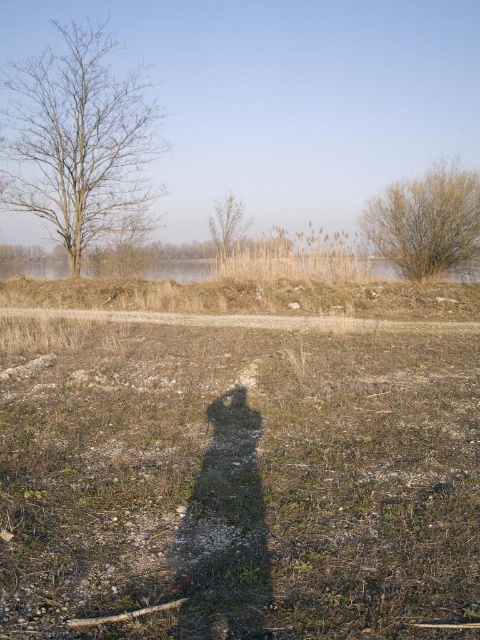
This screenshot has width=480, height=640. What do you see at coordinates (80, 144) in the screenshot?
I see `bare wood tree at upper left` at bounding box center [80, 144].

Image resolution: width=480 pixels, height=640 pixels. I want to click on bare wood tree at upper left, so click(x=80, y=144).

This screenshot has width=480, height=640. I want to click on bare wood tree at upper left, so click(x=80, y=144).

Does brown gravelly dirt field at center have a larger size compared to bare wood tree at center?

Correct, brown gravelly dirt field at center is larger in size than bare wood tree at center.

This screenshot has height=640, width=480. What are the coordinates of `brown gravelly dirt field at center` in the screenshot? It's located at (239, 465).

Image resolution: width=480 pixels, height=640 pixels. Identify the location of brown gravelly dirt field at center. pyautogui.click(x=239, y=465).

Locate an element on the screen. Image resolution: width=480 pixels, height=640 pixels. brown gravelly dirt field at center is located at coordinates (239, 465).

Is green leafy bush at upper right in front of bare wood tree at center?

Yes, it is.

Is green leafy bush at upper right below bare wood tree at center?

Yes.

Where is `green leafy bush at upper right`? This screenshot has height=640, width=480. green leafy bush at upper right is located at coordinates (427, 224).